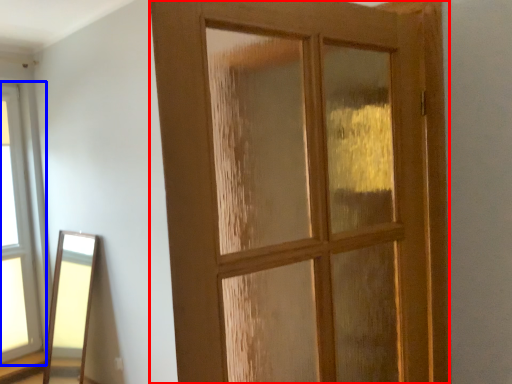
Question: Which object appears farthest to the camera in this image, door (highlighted by a red box) or window (highlighted by a blue box)?

Choices:
 (A) door
 (B) window

Answer: (B)